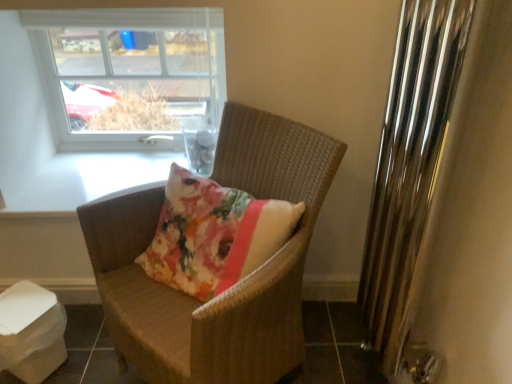
What is the approximate width of woven brown chair at center?

woven brown chair at center is 23.73 inches wide.

What do you see at coordinates (410, 175) in the screenshot? The image size is (512, 384). I see `polished chrome radiator at right` at bounding box center [410, 175].

Measure the distance between point (161, 82) and camera.

Point (161, 82) is 6.17 feet from camera.

Where is `woven brown chair at center`? This screenshot has width=512, height=384. woven brown chair at center is located at coordinates (232, 287).

Considering the positions of objects woven brown chair at center and clear glass window at upper left in the image provided, who is more to the right, woven brown chair at center or clear glass window at upper left?

From the viewer's perspective, woven brown chair at center appears more on the right side.

Considering the sizes of objects woven brown chair at center and clear glass window at upper left in the image provided, who is taller, woven brown chair at center or clear glass window at upper left?

woven brown chair at center.

Are woven brown chair at center and clear glass window at upper left located far from each other?

That's not correct — woven brown chair at center is a little close to clear glass window at upper left.

Is point (261, 316) farther from viewer compared to point (131, 59)?

No.

Is polished chrome radiator at right positioned beyond the bounds of woven brown chair at center?

Yes, polished chrome radiator at right is not within woven brown chair at center.

From their relative heights in the image, would you say polished chrome radiator at right is taller or shorter than woven brown chair at center?

Clearly, polished chrome radiator at right is taller compared to woven brown chair at center.

Where is `radiator lying above the woven brown chair at center (from the image's perspective)`? This screenshot has height=384, width=512. radiator lying above the woven brown chair at center (from the image's perspective) is located at coordinates (410, 175).

Is woven brown chair at center positioned with its back to polished chrome radiator at right?

No, woven brown chair at center is not facing the opposite direction of polished chrome radiator at right.

Where is `chair beneath the polished chrome radiator at right (from a real-world perspective)`? chair beneath the polished chrome radiator at right (from a real-world perspective) is located at coordinates (232, 287).

Which is behind, woven brown chair at center or polished chrome radiator at right?

woven brown chair at center is further away from the camera.

Is woven brown chair at center spatially inside polished chrome radiator at right, or outside of it?

woven brown chair at center cannot be found inside polished chrome radiator at right.

From the image's perspective, which one is positioned higher, polished chrome radiator at right or clear glass window at upper left?

clear glass window at upper left.

Does polished chrome radiator at right turn towards clear glass window at upper left?

No, polished chrome radiator at right is not turned towards clear glass window at upper left.

Looking at the image, does polished chrome radiator at right seem bigger or smaller compared to clear glass window at upper left?

polished chrome radiator at right is bigger than clear glass window at upper left.

How much distance is there between polished chrome radiator at right and clear glass window at upper left?

polished chrome radiator at right and clear glass window at upper left are 36.23 inches apart.

From the image's perspective, which is above, clear glass window at upper left or polished chrome radiator at right?

clear glass window at upper left, from the image's perspective.

Can you confirm if clear glass window at upper left is wider than polished chrome radiator at right?

No.

Between clear glass window at upper left and polished chrome radiator at right, which one has more height?

With more height is polished chrome radiator at right.

Is clear glass window at upper left taller or shorter than woven brown chair at center?

Clearly, clear glass window at upper left is shorter compared to woven brown chair at center.

Considering the sizes of clear glass window at upper left and woven brown chair at center in the image, is clear glass window at upper left bigger or smaller than woven brown chair at center?

clear glass window at upper left is smaller than woven brown chair at center.

Would you say clear glass window at upper left is to the left or to the right of woven brown chair at center in the picture?

In the image, clear glass window at upper left appears on the left side of woven brown chair at center.

From the image's perspective, which is below, clear glass window at upper left or woven brown chair at center?

woven brown chair at center is shown below in the image.

The height and width of the screenshot is (384, 512). Find the location of `chair that appears below the clear glass window at upper left (from a real-world perspective)`. chair that appears below the clear glass window at upper left (from a real-world perspective) is located at coordinates (232, 287).

In order to click on radiator that is on the right side of woven brown chair at center in this screenshot , I will do `click(410, 175)`.

From the image, which object appears to be farther from woven brown chair at center, polished chrome radiator at right or clear glass window at upper left?

clear glass window at upper left is further to woven brown chair at center.

Based on the photo, looking at the image, which one is located further to clear glass window at upper left, woven brown chair at center or polished chrome radiator at right?

polished chrome radiator at right is positioned further to the anchor clear glass window at upper left.

Based on their spatial positions, is clear glass window at upper left or woven brown chair at center closer to polished chrome radiator at right?

Based on the image, woven brown chair at center appears to be nearer to polished chrome radiator at right.

Based on their spatial positions, is clear glass window at upper left or polished chrome radiator at right closer to woven brown chair at center?

polished chrome radiator at right lies closer to woven brown chair at center than the other object.

When comparing their distances from polished chrome radiator at right, does woven brown chair at center or clear glass window at upper left seem closer?

Among the two, woven brown chair at center is located nearer to polished chrome radiator at right.

Looking at the image, which one is located further to clear glass window at upper left, polished chrome radiator at right or woven brown chair at center?

polished chrome radiator at right is positioned further to the anchor clear glass window at upper left.

The height and width of the screenshot is (384, 512). What are the coordinates of `chair located between polished chrome radiator at right and clear glass window at upper left in the depth direction` in the screenshot? It's located at (232, 287).